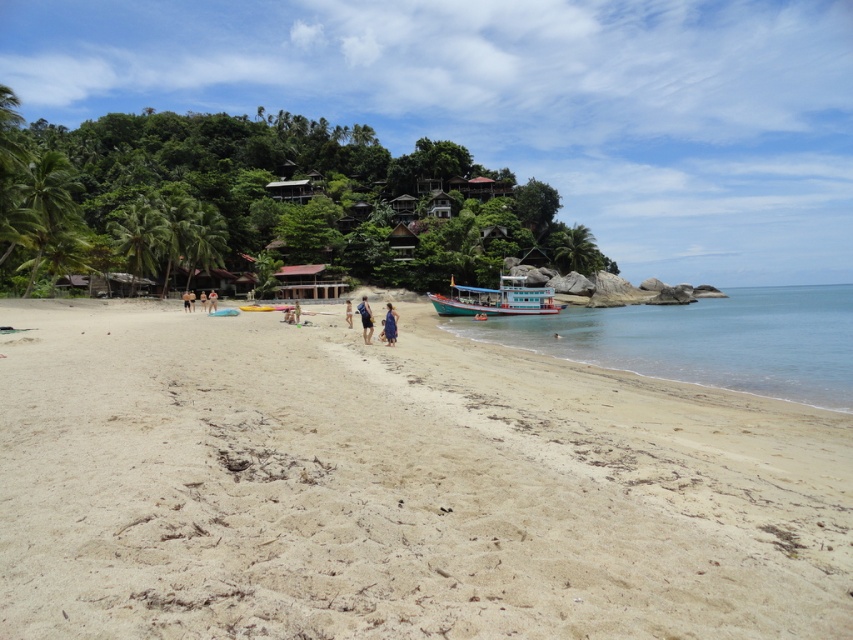
Can you confirm if clear blue water at lower right is positioned above blue fabric person at center?

Indeed, clear blue water at lower right is positioned over blue fabric person at center.

Between point (467, 333) and point (294, 321), which one is positioned in front?

Point (294, 321) is more forward.

Where is `clear blue water at lower right`? Image resolution: width=853 pixels, height=640 pixels. clear blue water at lower right is located at coordinates (706, 340).

Who is more forward, (485, 337) or (509, 308)?

Positioned in front is point (485, 337).

Looking at this image, between clear blue water at lower right and teal wooden boat at center, which one appears on the right side from the viewer's perspective?

clear blue water at lower right

What do you see at coordinates (706, 340) in the screenshot? This screenshot has width=853, height=640. I see `clear blue water at lower right` at bounding box center [706, 340].

Where is `clear blue water at lower right`? The height and width of the screenshot is (640, 853). clear blue water at lower right is located at coordinates (706, 340).

Who is lower down, matte blue swimsuit at center or blue fabric person at center?

matte blue swimsuit at center

Can you confirm if matte blue swimsuit at center is positioned to the right of blue fabric person at center?

Correct, you'll find matte blue swimsuit at center to the right of blue fabric person at center.

Is point (370, 317) behind point (297, 314)?

No, it is in front of (297, 314).

Locate an element on the screen. The image size is (853, 640). matte blue swimsuit at center is located at coordinates (364, 320).